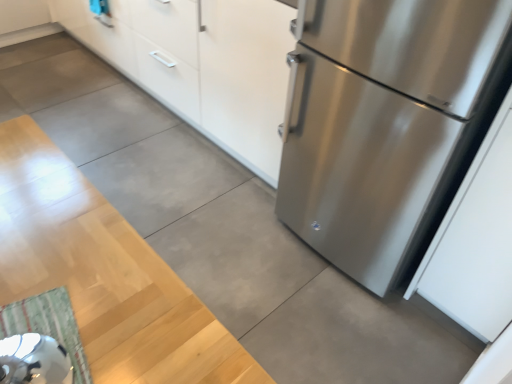
Image resolution: width=512 pixels, height=384 pixels. Identify the location of empty space that is ontop of green striped rug at lower left (from a real-world perspective). (36, 331).